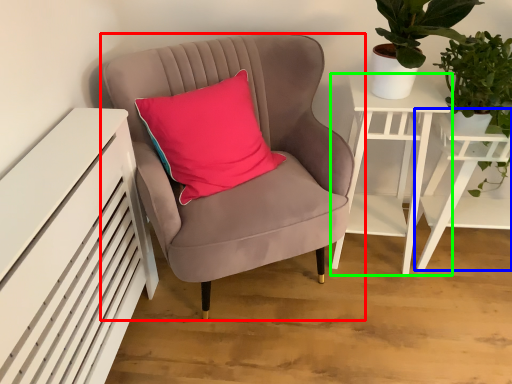
Question: Considering the real-world distances, which object is farthest from chair (highlighted by a red box)? table (highlighted by a blue box) or nightstand (highlighted by a green box)?

Choices:
 (A) table
 (B) nightstand

Answer: (A)